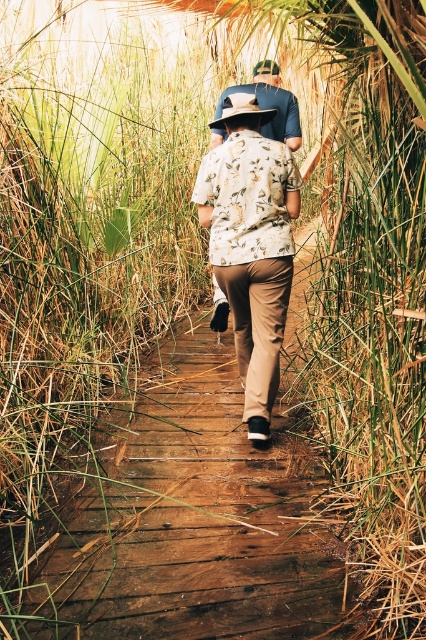
You are standing on the boardwalk and want to hand a map to the person in the white floral shirt at center. Which direction should you move to ensure you can reach them without approaching the matte blue shirt at center?

The white floral shirt at center is closer to the viewer than the matte blue shirt at center, so you should move forward towards the white floral shirt at center to reach them without getting closer to the matte blue shirt at center.

You are a photographer trying to capture both the white floral shirt at center and the matte blue shirt at center in a single frame. Given their sizes, which shirt would you need to position closer to the camera to ensure both fit in the shot?

Since the white floral shirt at center is narrower than the matte blue shirt at center, you should position the wider matte blue shirt at center closer to the camera to ensure both fit within the frame.

You are standing at the origin point of the coordinate system. Which direction should you move to reach the white floral shirt at center?

The white floral shirt at center is located at coordinates 0.383 on the x axis and 0.589 on the y axis, so you should move northeast to reach it.